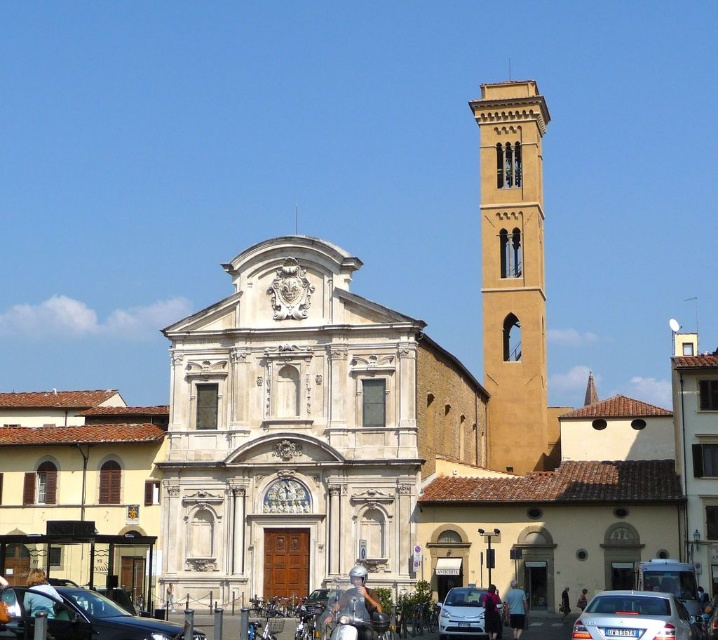
From the picture: You are standing in front of the historic church and want to determine the relative positions of two specific points marked on the scene. The first point, point (200, 637), is located near the base of the bell tower, while the second point, point (610, 627), is situated higher up on the bell tower. Which of these two points is closer to you?

Point (200, 637) is closer to the viewer than point (610, 627).

You are a tourist standing in front of the historic church. You see the yellow stone bell tower at upper right and the silver metallic sedan at lower right. Which object is positioned more to the east if the church faces north?

The yellow stone bell tower at upper right is positioned more to the east because it is to the right of the silver metallic sedan at lower right, and since the church faces north, the right side would correspond to the east direction.

You are a photographer positioned in front of the historic church. You want to capture a photo that includes both the yellow stone bell tower at upper right and the silver metallic sedan at lower right. However, you notice that the bell tower might be wider than the sedan. Could the bell tower potentially block the view of the sedan in your photo?

The yellow stone bell tower at upper right might be wider than the silver metallic sedan at lower right, so there is a possibility that the bell tower could block the view of the sedan in the photo depending on the angle and composition.